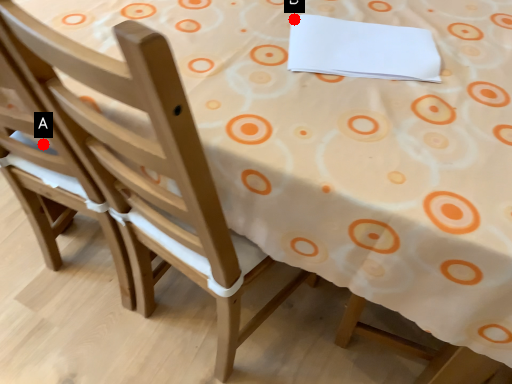
Question: Two points are circled on the image, labeled by A and B beside each circle. Which point is closer to the camera taking this photo?

Choices:
 (A) A is closer
 (B) B is closer

Answer: (B)